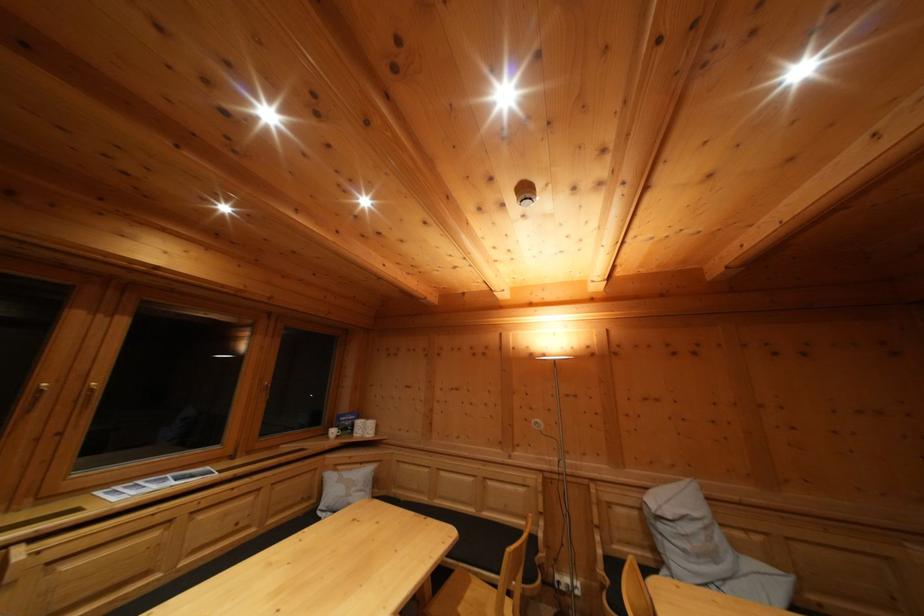
Find where to lift the white mug. Please return your answer as a coordinate pair (x, y).

(334, 431)